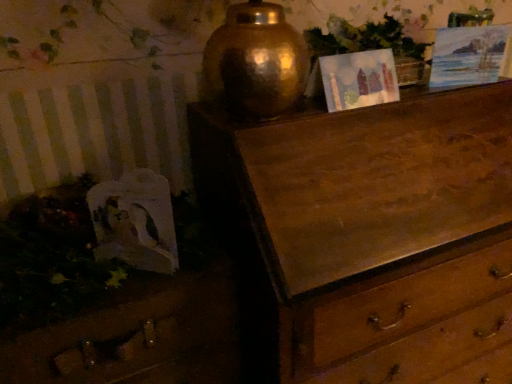
Where is `free location to the right of matte paper picture frame at upper center, which is counted as the first picture frame, starting from the left`? The height and width of the screenshot is (384, 512). free location to the right of matte paper picture frame at upper center, which is counted as the first picture frame, starting from the left is located at coordinates (418, 97).